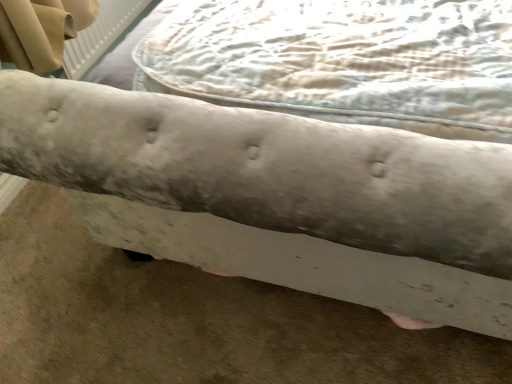
The image size is (512, 384). Describe the element at coordinates (343, 61) in the screenshot. I see `light beige textured mattress at center` at that location.

Based on the photo, what is the approximate height of light beige textured mattress at center?

light beige textured mattress at center is 4.69 inches tall.

Find the location of a particular element. light beige textured mattress at center is located at coordinates (343, 61).

The height and width of the screenshot is (384, 512). In order to click on frosted glass bench at center in this screenshot , I will do `click(277, 195)`.

What do you see at coordinates (277, 195) in the screenshot?
I see `frosted glass bench at center` at bounding box center [277, 195].

What is the approximate width of frosted glass bench at center?

frosted glass bench at center is 1.46 meters wide.

This screenshot has width=512, height=384. I want to click on light beige textured mattress at center, so click(343, 61).

Can you confirm if light beige textured mattress at center is positioned to the left of frosted glass bench at center?

Yes.

Is the position of light beige textured mattress at center more distant than that of frosted glass bench at center?

Yes, light beige textured mattress at center is further from the camera.

Considering the points (289, 30) and (64, 118), which point is in front, point (289, 30) or point (64, 118)?

The point (64, 118) is closer.

From the image's perspective, is light beige textured mattress at center over frosted glass bench at center?

Incorrect, from the image's perspective, light beige textured mattress at center is lower than frosted glass bench at center.

From a real-world perspective, is light beige textured mattress at center positioned under frosted glass bench at center based on gravity?

Incorrect, from a real-world perspective, light beige textured mattress at center is higher than frosted glass bench at center.

Considering the sizes of objects light beige textured mattress at center and frosted glass bench at center in the image provided, who is thinner, light beige textured mattress at center or frosted glass bench at center?

light beige textured mattress at center is thinner.

Considering the sizes of light beige textured mattress at center and frosted glass bench at center in the image, is light beige textured mattress at center taller or shorter than frosted glass bench at center?

Considering their sizes, light beige textured mattress at center has less height than frosted glass bench at center.

Between light beige textured mattress at center and frosted glass bench at center, which one has larger size?

frosted glass bench at center.

Is frosted glass bench at center surrounded by light beige textured mattress at center?

That's incorrect, frosted glass bench at center is not inside light beige textured mattress at center.

Would you consider light beige textured mattress at center to be distant from frosted glass bench at center?

No, light beige textured mattress at center is not far away from frosted glass bench at center.

Is light beige textured mattress at center aimed at frosted glass bench at center?

Yes, light beige textured mattress at center is facing frosted glass bench at center.

Can you tell me how much light beige textured mattress at center and frosted glass bench at center differ in facing direction?

The facing directions of light beige textured mattress at center and frosted glass bench at center are 8.77e-05 degrees apart.

How much distance is there between light beige textured mattress at center and frosted glass bench at center?

A distance of 10.77 inches exists between light beige textured mattress at center and frosted glass bench at center.

The width and height of the screenshot is (512, 384). In order to click on sheet above the frosted glass bench at center (from a real-world perspective) in this screenshot , I will do `click(343, 61)`.

Is frosted glass bench at center to the right of light beige textured mattress at center from the viewer's perspective?

Yes, frosted glass bench at center is to the right of light beige textured mattress at center.

Which is in front, frosted glass bench at center or light beige textured mattress at center?

frosted glass bench at center is in front.

Considering the points (450, 312) and (167, 36), which point is in front, point (450, 312) or point (167, 36)?

The point (450, 312) is closer.

From the image's perspective, is frosted glass bench at center on top of light beige textured mattress at center?

Yes, from the image's perspective, frosted glass bench at center is on top of light beige textured mattress at center.

From a real-world perspective, is frosted glass bench at center physically below light beige textured mattress at center?

Indeed, from a real-world perspective, frosted glass bench at center is positioned beneath light beige textured mattress at center.

Considering the relative sizes of frosted glass bench at center and light beige textured mattress at center in the image provided, is frosted glass bench at center thinner than light beige textured mattress at center?

No, frosted glass bench at center is not thinner than light beige textured mattress at center.

Considering the sizes of objects frosted glass bench at center and light beige textured mattress at center in the image provided, who is taller, frosted glass bench at center or light beige textured mattress at center?

frosted glass bench at center.

Which of these two, frosted glass bench at center or light beige textured mattress at center, is smaller?

With smaller size is light beige textured mattress at center.

From the picture: Is light beige textured mattress at center located within frosted glass bench at center?

Yes, frosted glass bench at center contains light beige textured mattress at center.

Is frosted glass bench at center far from light beige textured mattress at center?

frosted glass bench at center is near light beige textured mattress at center, not far away.

Does frosted glass bench at center turn towards light beige textured mattress at center?

Yes, frosted glass bench at center is facing light beige textured mattress at center.

There is a frosted glass bench at center. At what (x,y) coordinates should I click in order to perform the action: click on sheet above it (from a real-world perspective). Please return your answer as a coordinate pair (x, y). This screenshot has width=512, height=384. Looking at the image, I should click on click(x=343, y=61).

This screenshot has width=512, height=384. Find the location of `furniture located underneath the light beige textured mattress at center (from a real-world perspective)`. furniture located underneath the light beige textured mattress at center (from a real-world perspective) is located at coordinates (277, 195).

I want to click on sheet behind the frosted glass bench at center, so click(343, 61).